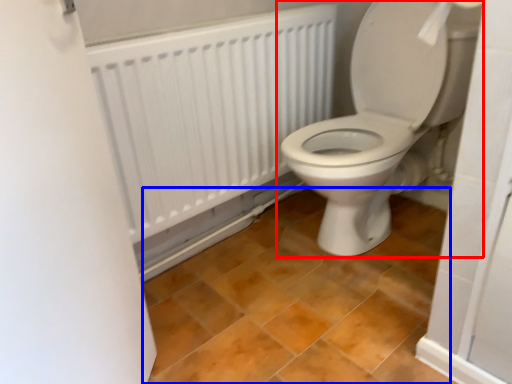
Question: Which point is closer to the camera, toilet (highlighted by a red box) or ceramic tile (highlighted by a blue box)?

Choices:
 (A) toilet
 (B) ceramic tile

Answer: (B)